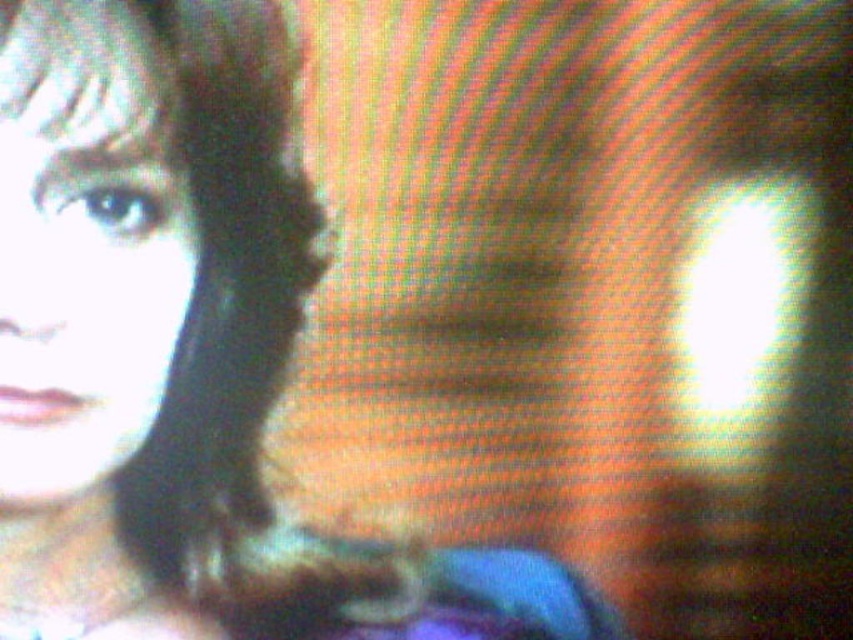
Question: In this image, where is smooth skin face at upper left located relative to smooth black hair at upper left?

Choices:
 (A) below
 (B) above

Answer: (A)

Question: Among these objects, which one is nearest to the camera?

Choices:
 (A) smooth skin face at upper left
 (B) smooth black hair at upper left

Answer: (B)

Question: Which object appears closest to the camera in this image?

Choices:
 (A) smooth black hair at upper left
 (B) smooth skin face at upper left

Answer: (A)

Question: Does smooth skin face at upper left have a greater width compared to smooth black hair at upper left?

Choices:
 (A) no
 (B) yes

Answer: (B)

Question: Which of the following is the farthest from the observer?

Choices:
 (A) (32, 54)
 (B) (80, 320)
 (C) (45, 61)

Answer: (B)

Question: Does matte black hair at upper left appear under smooth black hair at upper left?

Choices:
 (A) yes
 (B) no

Answer: (A)